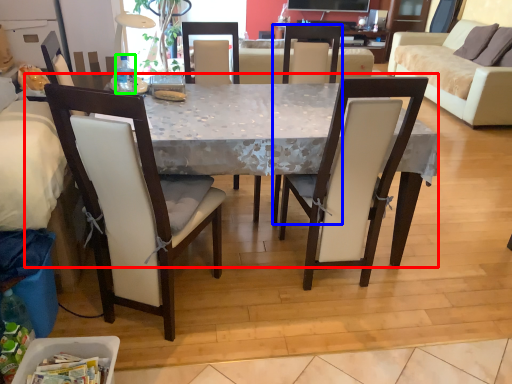
Question: Based on their relative distances, which object is farther from desk (highlighted by a red box)? Choose from chair (highlighted by a blue box) and bottle (highlighted by a green box).

Choices:
 (A) chair
 (B) bottle

Answer: (B)